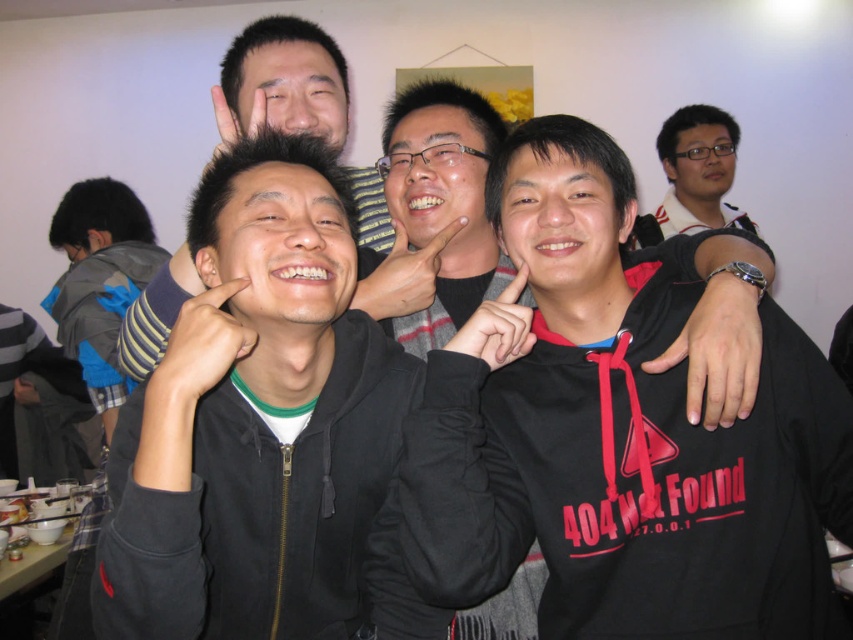
Based on the photo, you are trying to identify the position of the black matte hoodie at center relative to the matte skin hand at center in the image. Based on the scene description, can you determine which side the hoodie is located on?

The black matte hoodie at center is located to the right of the matte skin hand at center.

You are a photographer trying to adjust the lighting for a photo shoot. You notice the black matte hoodie at center and the matte skin hand at center in the frame. Which object should you focus your light on to ensure proper exposure, considering their sizes?

The black matte hoodie at center is much taller than the matte skin hand at center, so you should focus the light on the larger object, the black matte hoodie at center, to ensure proper exposure.